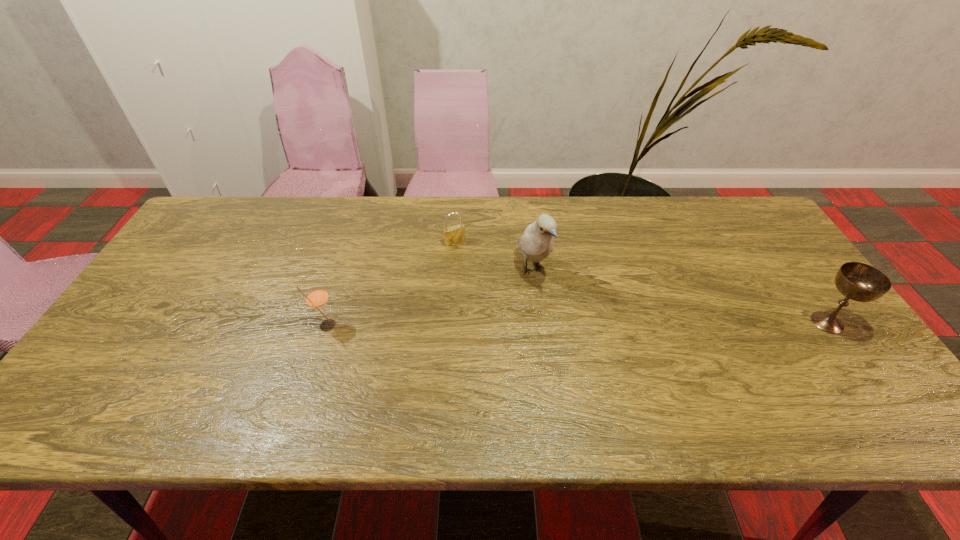
Where is `vacant space located 0.190m on the front-facing side of the second object from left to right`? The width and height of the screenshot is (960, 540). vacant space located 0.190m on the front-facing side of the second object from left to right is located at coordinates (487, 286).

At what (x,y) coordinates should I click in order to perform the action: click on vacant space situated 0.130m at the beak of the bird. Please return your answer as a coordinate pair (x, y). This screenshot has height=540, width=960. Looking at the image, I should click on (564, 327).

Image resolution: width=960 pixels, height=540 pixels. In order to click on free location located at the beak of the bird in this screenshot , I will do `click(579, 351)`.

Identify the location of free space located at the beak of the bird. [573, 341].

The image size is (960, 540). In order to click on object that is at the far edge in this screenshot , I will do `click(454, 234)`.

Image resolution: width=960 pixels, height=540 pixels. What are the coordinates of `object that is at the right edge` in the screenshot? It's located at (860, 282).

Where is `blank space at the far edge of the desktop`? The image size is (960, 540). blank space at the far edge of the desktop is located at coordinates (649, 208).

Identify the location of free space at the left edge of the desktop. (160, 284).

Locate an element on the screen. Image resolution: width=960 pixels, height=540 pixels. vacant region at the right edge of the desktop is located at coordinates (772, 271).

In the image, there is a desktop. Where is `vacant space at the far left corner`? This screenshot has height=540, width=960. vacant space at the far left corner is located at coordinates coord(233,203).